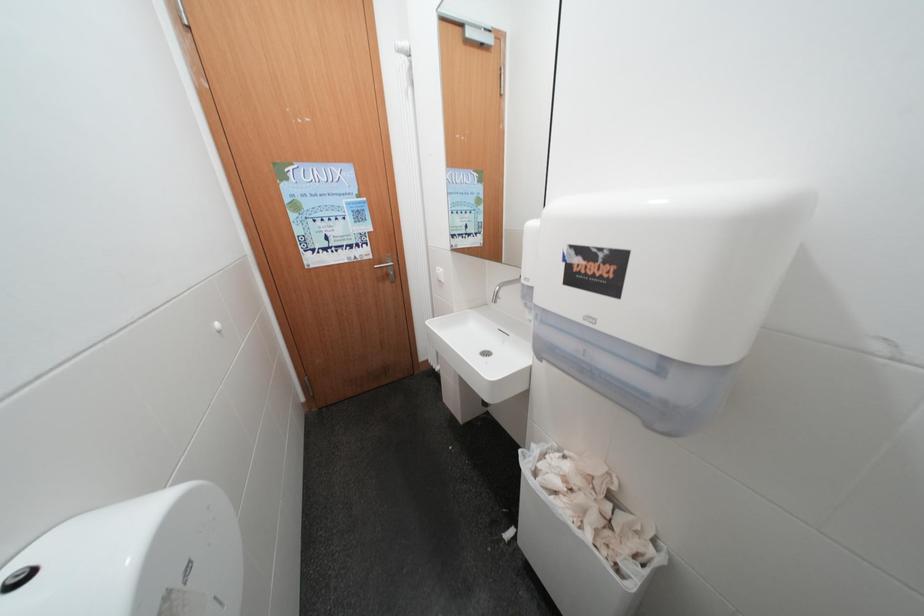
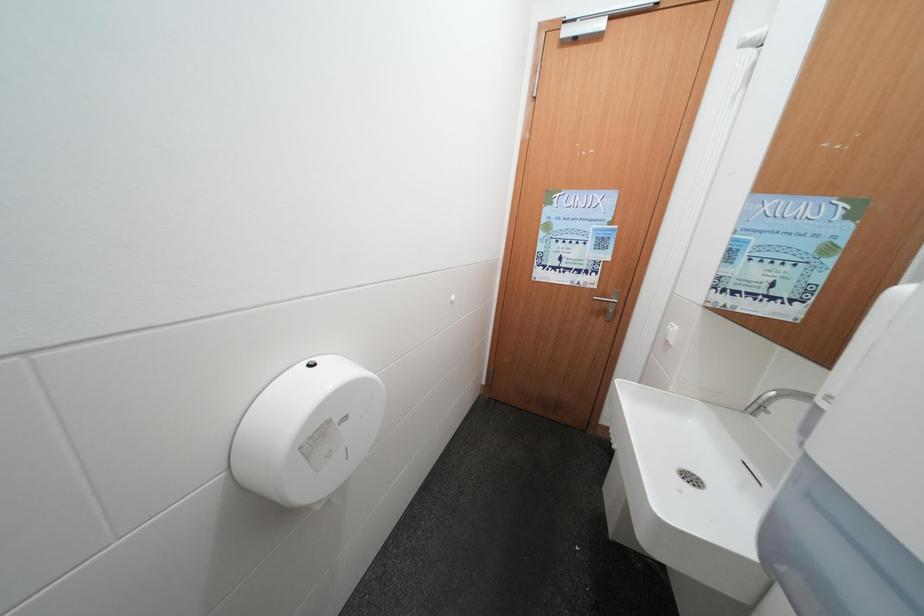
Question: The first image is from the beginning of the video and the second image is from the end. How did the camera likely rotate when shooting the video?

Choices:
 (A) Left
 (B) Right
 (C) Up
 (D) Down

Answer: (A)